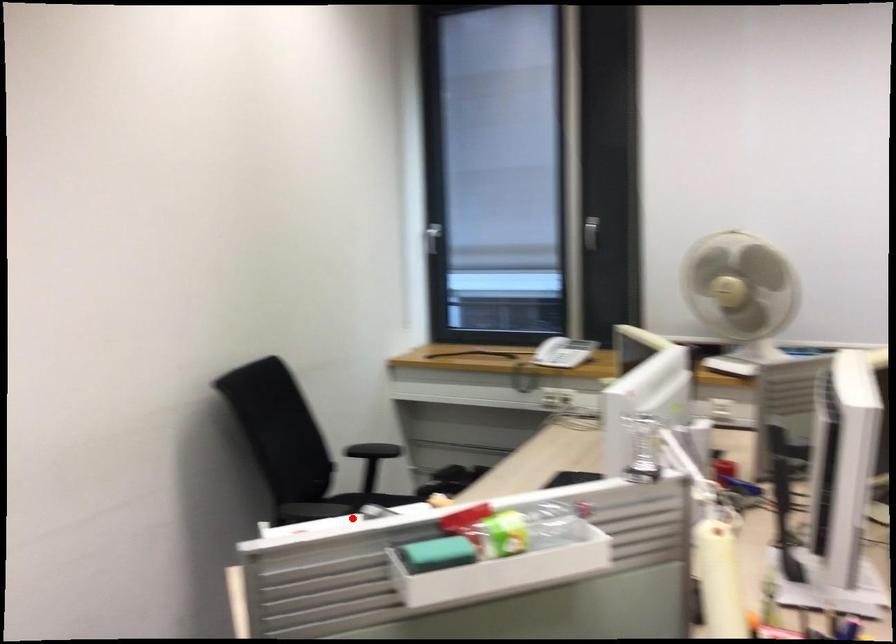
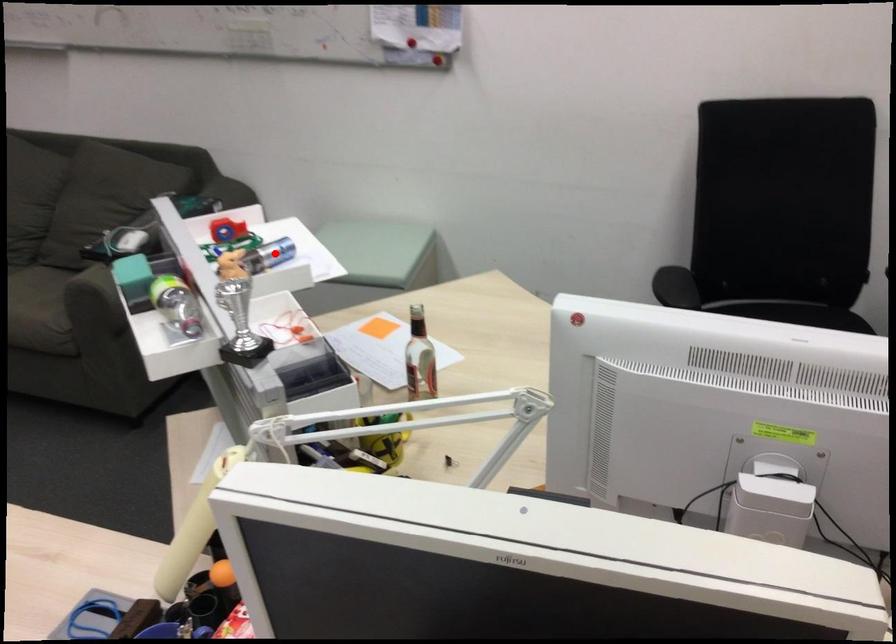
I am providing you with two images of the same scene from different viewpoints. A red point is marked on the first image and another point is marked on the second image. Are the points marked in image1 and image2 representing the same 3D position?

Yes